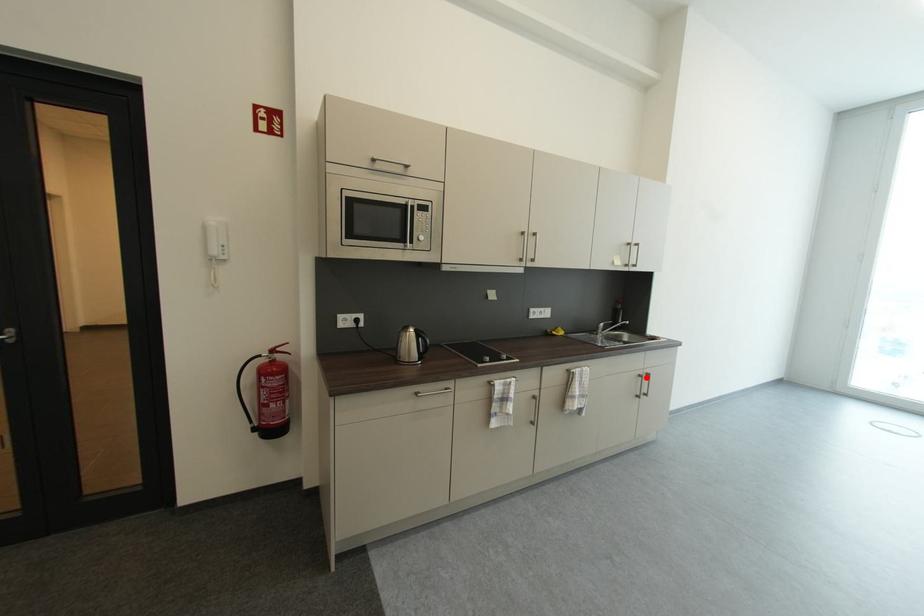
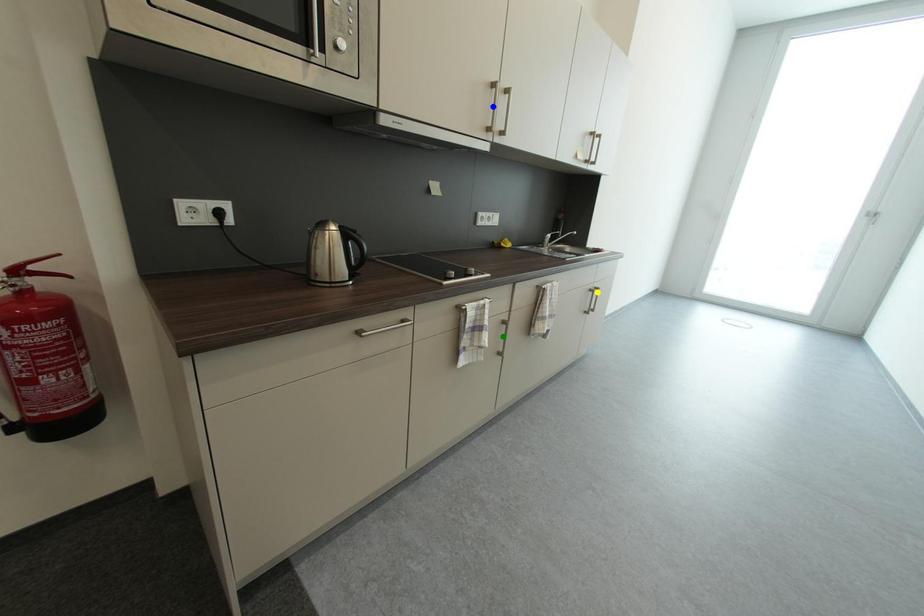
Question: I am providing you with two images of the same scene from different viewpoints. A red point is marked on the first image. You are given multiple points on the second image. Which point in image 2 is actually the same real-world point as the red point in image 1?

Choices:
 (A) blue point
 (B) yellow point
 (C) green point

Answer: (B)